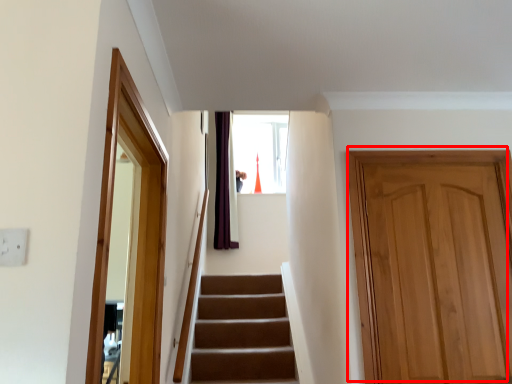
Question: From the image's perspective, where is door (annotated by the red box) located relative to screen door?

Choices:
 (A) below
 (B) above

Answer: (A)